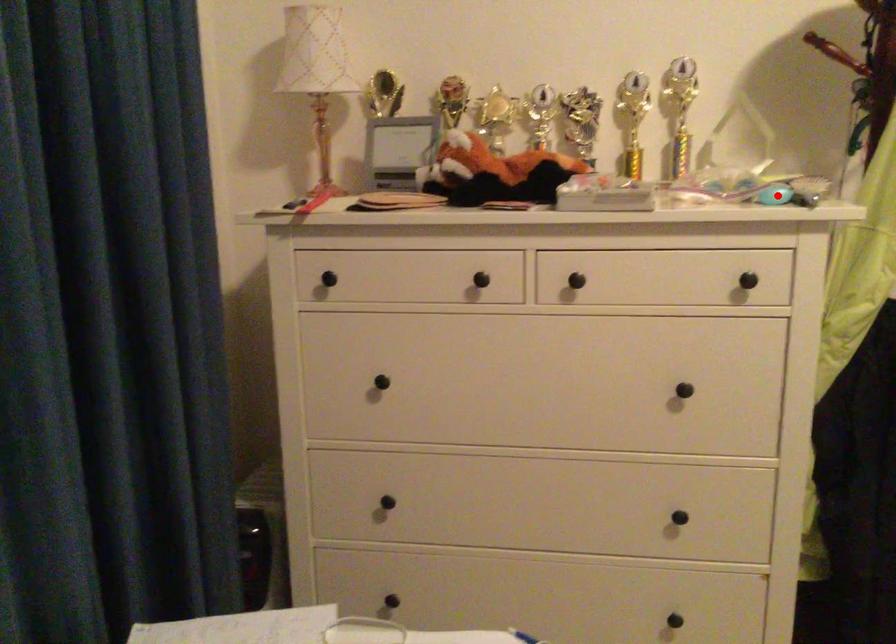
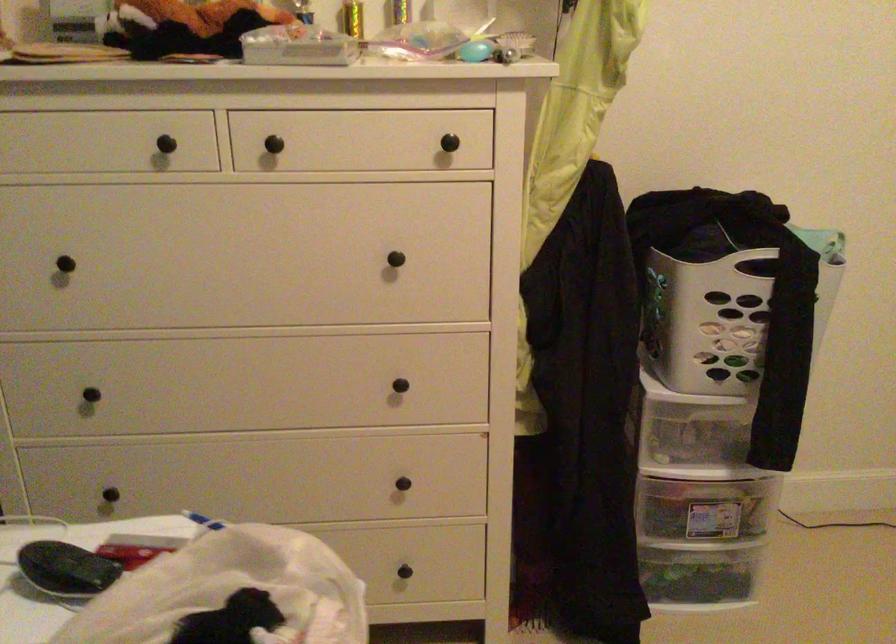
Where in the second image is the point corresponding to the highlighted location from the first image?

(475, 51)